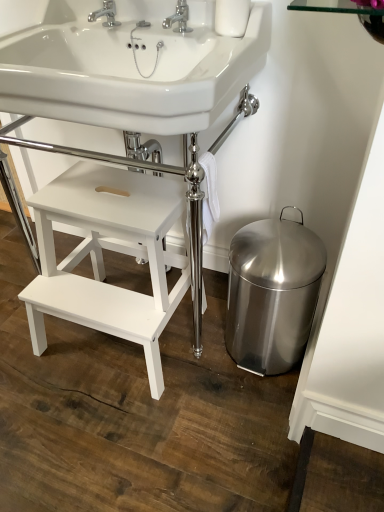
At what (x,y) coordinates should I click in order to perform the action: click on stainless steel bidet at lower right. Please return your answer as a coordinate pair (x, y). The height and width of the screenshot is (512, 384). Looking at the image, I should click on (272, 293).

This screenshot has width=384, height=512. Identify the location of white matte stool at lower left. (102, 256).

How much space does chrome metallic faucet at upper center, which is the 1th tap in right-to-left order, occupy vertically?

4.83 inches.

The height and width of the screenshot is (512, 384). Identify the location of white glossy sink at upper center, positioned as the 1th sink in bottom-to-top order. (136, 73).

Between point (88, 301) and point (90, 33), which one is positioned in front?

The point (90, 33) is in front.

Considering the positions of objects white matte stool at lower left and white glossy sink at upper center, positioned as the 1th sink in bottom-to-top order, in the image provided, who is more to the right, white matte stool at lower left or white glossy sink at upper center, positioned as the 1th sink in bottom-to-top order,?

From the viewer's perspective, white glossy sink at upper center, positioned as the 1th sink in bottom-to-top order, appears more on the right side.

Can you tell me how much white matte stool at lower left and white glossy sink at upper center, positioned as the 1th sink in bottom-to-top order, differ in facing direction?

There is a 0.000396-degree angle between the facing directions of white matte stool at lower left and white glossy sink at upper center, positioned as the 1th sink in bottom-to-top order.

Is white glossy sink at upper center, the 2th sink positioned from the bottom, inside or outside of chrome metallic faucet at upper center, acting as the second tap starting from the left?

The correct answer is: outside.

Consider the image. Is white glossy sink at upper center, which is counted as the 1th sink, starting from the top, at the right side of chrome metallic faucet at upper center, acting as the second tap starting from the left?

In fact, white glossy sink at upper center, which is counted as the 1th sink, starting from the top, is to the left of chrome metallic faucet at upper center, acting as the second tap starting from the left.

Is point (16, 62) positioned in front of point (162, 24)?

Yes, point (16, 62) is in front of point (162, 24).

Could you tell me if white glossy sink at upper center, the 2th sink positioned from the bottom, is turned towards chrome metallic faucet at upper center, acting as the second tap starting from the left?

No, white glossy sink at upper center, the 2th sink positioned from the bottom, does not turn towards chrome metallic faucet at upper center, acting as the second tap starting from the left.

Considering the positions of objects chrome metallic faucet at upper center, which is the 1th tap in right-to-left order, and stainless steel bidet at lower right in the image provided, who is more to the left, chrome metallic faucet at upper center, which is the 1th tap in right-to-left order, or stainless steel bidet at lower right?

chrome metallic faucet at upper center, which is the 1th tap in right-to-left order, is more to the left.

The width and height of the screenshot is (384, 512). I want to click on bidet below the chrome metallic faucet at upper center, acting as the second tap starting from the left (from a real-world perspective), so 272,293.

How different are the orientations of chrome metallic faucet at upper center, acting as the second tap starting from the left, and stainless steel bidet at lower right in degrees?

1.55 degrees separate the facing orientations of chrome metallic faucet at upper center, acting as the second tap starting from the left, and stainless steel bidet at lower right.

Which of these two, chrome metallic faucet at upper center, which is the 1th tap in right-to-left order, or stainless steel bidet at lower right, stands shorter?

chrome metallic faucet at upper center, which is the 1th tap in right-to-left order.

From the picture: Considering the relative positions of stainless steel bidet at lower right and white glossy sink at upper center, positioned as the 1th sink in bottom-to-top order, in the image provided, is stainless steel bidet at lower right to the right of white glossy sink at upper center, positioned as the 1th sink in bottom-to-top order, from the viewer's perspective?

Correct, you'll find stainless steel bidet at lower right to the right of white glossy sink at upper center, positioned as the 1th sink in bottom-to-top order.

From the image's perspective, would you say stainless steel bidet at lower right is shown under white glossy sink at upper center, which is the second sink in top-to-bottom order?

Yes, from the image's perspective, stainless steel bidet at lower right is beneath white glossy sink at upper center, which is the second sink in top-to-bottom order.

Is stainless steel bidet at lower right wider than white glossy sink at upper center, positioned as the 1th sink in bottom-to-top order?

Incorrect, the width of stainless steel bidet at lower right does not surpass that of white glossy sink at upper center, positioned as the 1th sink in bottom-to-top order.

Does stainless steel bidet at lower right lie in front of white matte stool at lower left?

That is False.

In the image, there is a stainless steel bidet at lower right. At what (x,y) coordinates should I click in order to perform the action: click on table above it (from the image's perspective). Please return your answer as a coordinate pair (x, y). This screenshot has height=512, width=384. Looking at the image, I should click on (102, 256).

Is stainless steel bidet at lower right spatially inside white matte stool at lower left, or outside of it?

stainless steel bidet at lower right is not inside white matte stool at lower left, it's outside.

From the image's perspective, between stainless steel bidet at lower right and chrome metallic faucet at upper center, acting as the second tap starting from the left, which one is located above?

chrome metallic faucet at upper center, acting as the second tap starting from the left, from the image's perspective.

From the picture: Is stainless steel bidet at lower right not inside chrome metallic faucet at upper center, acting as the second tap starting from the left?

Absolutely, stainless steel bidet at lower right is external to chrome metallic faucet at upper center, acting as the second tap starting from the left.

In terms of width, does stainless steel bidet at lower right look wider or thinner when compared to chrome metallic faucet at upper center, acting as the second tap starting from the left?

Clearly, stainless steel bidet at lower right has more width compared to chrome metallic faucet at upper center, acting as the second tap starting from the left.

Considering the relative positions of stainless steel bidet at lower right and chrome metallic faucet at upper center, which is the 1th tap in right-to-left order, in the image provided, is stainless steel bidet at lower right in front of chrome metallic faucet at upper center, which is the 1th tap in right-to-left order,?

No, it is behind chrome metallic faucet at upper center, which is the 1th tap in right-to-left order.

Is silver metallic faucet at upper center, the first tap in the left-to-right sequence, inside white glossy sink at upper center, which is the second sink in top-to-bottom order?

No, white glossy sink at upper center, which is the second sink in top-to-bottom order, does not contain silver metallic faucet at upper center, the first tap in the left-to-right sequence.

From the image's perspective, which is above, white glossy sink at upper center, which is the second sink in top-to-bottom order, or silver metallic faucet at upper center, the first tap in the left-to-right sequence?

From the image's view, silver metallic faucet at upper center, the first tap in the left-to-right sequence, is above.

Is white glossy sink at upper center, positioned as the 1th sink in bottom-to-top order, at the right side of silver metallic faucet at upper center, arranged as the 2th tap when viewed from the right?

Yes.

Is white glossy sink at upper center, which is the second sink in top-to-bottom order, aimed at silver metallic faucet at upper center, arranged as the 2th tap when viewed from the right?

No, white glossy sink at upper center, which is the second sink in top-to-bottom order, is not facing towards silver metallic faucet at upper center, arranged as the 2th tap when viewed from the right.

Locate an element on the screen. Image resolution: width=384 pixels, height=512 pixels. table below the white glossy sink at upper center, positioned as the 1th sink in bottom-to-top order (from the image's perspective) is located at coordinates (102, 256).

Starting from the chrome metallic faucet at upper center, acting as the second tap starting from the left, which sink is the 2nd one in front? Please provide its 2D coordinates.

[(130, 73)]

In the scene shown: Considering their positions, is chrome metallic faucet at upper center, which is the 1th tap in right-to-left order, positioned further to white glossy sink at upper center, positioned as the 1th sink in bottom-to-top order, than white glossy sink at upper center, which is counted as the 1th sink, starting from the top?

chrome metallic faucet at upper center, which is the 1th tap in right-to-left order, is further to white glossy sink at upper center, positioned as the 1th sink in bottom-to-top order.

Which object lies further to the anchor point stainless steel bidet at lower right, white glossy sink at upper center, the 2th sink positioned from the bottom, or white matte stool at lower left?

Based on the image, white glossy sink at upper center, the 2th sink positioned from the bottom, appears to be further to stainless steel bidet at lower right.

Based on their spatial positions, is stainless steel bidet at lower right or white matte stool at lower left further from white glossy sink at upper center, positioned as the 1th sink in bottom-to-top order?

stainless steel bidet at lower right is positioned further to the anchor white glossy sink at upper center, positioned as the 1th sink in bottom-to-top order.

Based on their spatial positions, is white matte stool at lower left or silver metallic faucet at upper center, arranged as the 2th tap when viewed from the right, closer to white glossy sink at upper center, positioned as the 1th sink in bottom-to-top order?

Based on the image, white matte stool at lower left appears to be nearer to white glossy sink at upper center, positioned as the 1th sink in bottom-to-top order.

Consider the image. Estimate the real-world distances between objects in this image. Which object is further from chrome metallic faucet at upper center, which is the 1th tap in right-to-left order, silver metallic faucet at upper center, arranged as the 2th tap when viewed from the right, or white glossy sink at upper center, positioned as the 1th sink in bottom-to-top order?

white glossy sink at upper center, positioned as the 1th sink in bottom-to-top order, is further to chrome metallic faucet at upper center, which is the 1th tap in right-to-left order.

Estimate the real-world distances between objects in this image. Which object is closer to silver metallic faucet at upper center, the first tap in the left-to-right sequence, chrome metallic faucet at upper center, acting as the second tap starting from the left, or stainless steel bidet at lower right?

chrome metallic faucet at upper center, acting as the second tap starting from the left, lies closer to silver metallic faucet at upper center, the first tap in the left-to-right sequence, than the other object.

Which object lies nearer to the anchor point chrome metallic faucet at upper center, acting as the second tap starting from the left, white matte stool at lower left or silver metallic faucet at upper center, arranged as the 2th tap when viewed from the right?

silver metallic faucet at upper center, arranged as the 2th tap when viewed from the right, is positioned closer to the anchor chrome metallic faucet at upper center, acting as the second tap starting from the left.

Considering their positions, is white glossy sink at upper center, which is the second sink in top-to-bottom order, positioned closer to white glossy sink at upper center, the 2th sink positioned from the bottom, than white matte stool at lower left?

Based on the image, white glossy sink at upper center, which is the second sink in top-to-bottom order, appears to be nearer to white glossy sink at upper center, the 2th sink positioned from the bottom.

At what (x,y) coordinates should I click in order to perform the action: click on sink between white glossy sink at upper center, which is counted as the 1th sink, starting from the top, and white matte stool at lower left from top to bottom. Please return your answer as a coordinate pair (x, y). The height and width of the screenshot is (512, 384). Looking at the image, I should click on (136, 73).

Image resolution: width=384 pixels, height=512 pixels. Identify the location of tap between white glossy sink at upper center, which is counted as the 1th sink, starting from the top, and silver metallic faucet at upper center, the first tap in the left-to-right sequence, from front to back. (179, 18).

I want to click on sink between chrome metallic faucet at upper center, acting as the second tap starting from the left, and white glossy sink at upper center, positioned as the 1th sink in bottom-to-top order, in the vertical direction, so click(x=130, y=73).

Find the location of `tap between silver metallic faucet at upper center, arranged as the 2th tap when viewed from the right, and white matte stool at lower left from top to bottom`. tap between silver metallic faucet at upper center, arranged as the 2th tap when viewed from the right, and white matte stool at lower left from top to bottom is located at coordinates (179, 18).